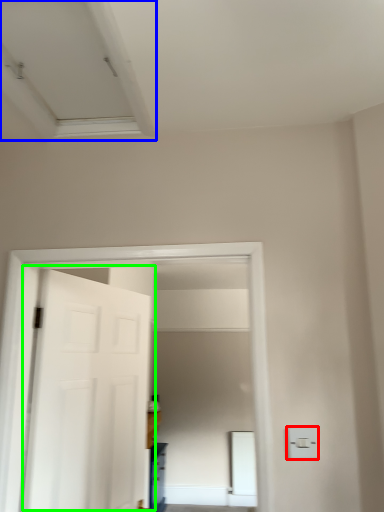
Question: Which object is positioned farthest from light switch (highlighted by a red box)? Select from exhaust hood (highlighted by a blue box) and door (highlighted by a green box).

Choices:
 (A) exhaust hood
 (B) door

Answer: (A)